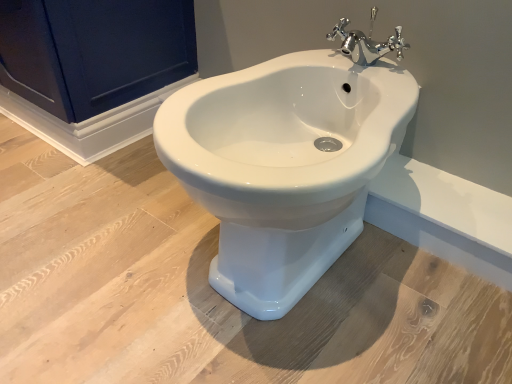
Find the location of a particular element. The height and width of the screenshot is (384, 512). white glossy bidet at center is located at coordinates (287, 160).

In order to click on chrome metallic faucet at upper center in this screenshot , I will do `click(367, 42)`.

What do you see at coordinates (120, 49) in the screenshot? I see `matte dark blue cabinet at upper left` at bounding box center [120, 49].

Locate an element on the screen. white glossy bidet at center is located at coordinates (287, 160).

Between white glossy bidet at center and chrome metallic faucet at upper center, which one appears on the left side from the viewer's perspective?

Positioned to the left is white glossy bidet at center.

Between white glossy bidet at center and chrome metallic faucet at upper center, which one has less height?

chrome metallic faucet at upper center is shorter.

Is point (289, 86) more distant than point (352, 46)?

That is False.

Is white glossy bidet at center bigger or smaller than chrome metallic faucet at upper center?

Clearly, white glossy bidet at center is larger in size than chrome metallic faucet at upper center.

Consider the image. Would you consider matte dark blue cabinet at upper left to be distant from white glossy bidet at center?

No, matte dark blue cabinet at upper left is not far from white glossy bidet at center.

Is matte dark blue cabinet at upper left smaller than white glossy bidet at center?

No.

From the picture: Which of these two, matte dark blue cabinet at upper left or white glossy bidet at center, is thinner?

matte dark blue cabinet at upper left is thinner.

From the image's perspective, does matte dark blue cabinet at upper left appear higher than white glossy bidet at center?

Yes, from the image's perspective, matte dark blue cabinet at upper left is over white glossy bidet at center.

From a real-world perspective, is white glossy bidet at center located beneath matte dark blue cabinet at upper left?

Yes, from a real-world perspective, white glossy bidet at center is below matte dark blue cabinet at upper left.

Considering their positions, is white glossy bidet at center located in front of or behind matte dark blue cabinet at upper left?

Clearly, white glossy bidet at center is in front of matte dark blue cabinet at upper left.

In the image, is white glossy bidet at center on the left side or the right side of matte dark blue cabinet at upper left?

Clearly, white glossy bidet at center is on the right of matte dark blue cabinet at upper left in the image.

Is chrome metallic faucet at upper center not within white glossy bidet at center?

Yes.

What's the angular difference between chrome metallic faucet at upper center and white glossy bidet at center's facing directions?

There is a 0.000808-degree angle between the facing directions of chrome metallic faucet at upper center and white glossy bidet at center.

Which object is wider, chrome metallic faucet at upper center or white glossy bidet at center?

white glossy bidet at center.

In the image, is chrome metallic faucet at upper center positioned in front of or behind white glossy bidet at center?

Visually, chrome metallic faucet at upper center is located behind white glossy bidet at center.

Is matte dark blue cabinet at upper left surrounding chrome metallic faucet at upper center?

No, chrome metallic faucet at upper center is located outside of matte dark blue cabinet at upper left.

Where is `screen door lying above the chrome metallic faucet at upper center (from the image's perspective)`? This screenshot has width=512, height=384. screen door lying above the chrome metallic faucet at upper center (from the image's perspective) is located at coordinates (120, 49).

Is matte dark blue cabinet at upper left looking in the opposite direction of chrome metallic faucet at upper center?

No, matte dark blue cabinet at upper left is not facing the opposite direction of chrome metallic faucet at upper center.

From a real-world perspective, is matte dark blue cabinet at upper left on top of chrome metallic faucet at upper center?

No, from a real-world perspective, matte dark blue cabinet at upper left is not on top of chrome metallic faucet at upper center.

Looking at this image, is chrome metallic faucet at upper center bigger or smaller than matte dark blue cabinet at upper left?

In the image, chrome metallic faucet at upper center appears to be smaller than matte dark blue cabinet at upper left.

From the image's perspective, between chrome metallic faucet at upper center and matte dark blue cabinet at upper left, which one is located above?

From the image's view, matte dark blue cabinet at upper left is above.

Can you confirm if chrome metallic faucet at upper center is wider than matte dark blue cabinet at upper left?

No.

Where is `toilet lying on the left of chrome metallic faucet at upper center`? The width and height of the screenshot is (512, 384). toilet lying on the left of chrome metallic faucet at upper center is located at coordinates (287, 160).

At what (x,y) coordinates should I click in order to perform the action: click on toilet on the right of matte dark blue cabinet at upper left. Please return your answer as a coordinate pair (x, y). Looking at the image, I should click on (287, 160).

Based on their spatial positions, is white glossy bidet at center or matte dark blue cabinet at upper left closer to chrome metallic faucet at upper center?

white glossy bidet at center.

Considering their positions, is white glossy bidet at center positioned further to matte dark blue cabinet at upper left than chrome metallic faucet at upper center?

white glossy bidet at center.

Consider the image. Based on their spatial positions, is matte dark blue cabinet at upper left or chrome metallic faucet at upper center further from white glossy bidet at center?

matte dark blue cabinet at upper left.

Which object lies further to the anchor point matte dark blue cabinet at upper left, chrome metallic faucet at upper center or white glossy bidet at center?

white glossy bidet at center.

From the image, which object appears to be farther from chrome metallic faucet at upper center, matte dark blue cabinet at upper left or white glossy bidet at center?

Based on the image, matte dark blue cabinet at upper left appears to be further to chrome metallic faucet at upper center.

When comparing their distances from white glossy bidet at center, does chrome metallic faucet at upper center or matte dark blue cabinet at upper left seem further?

matte dark blue cabinet at upper left lies further to white glossy bidet at center than the other object.

Locate an element on the screen. Image resolution: width=512 pixels, height=384 pixels. toilet between matte dark blue cabinet at upper left and chrome metallic faucet at upper center from left to right is located at coordinates (287, 160).